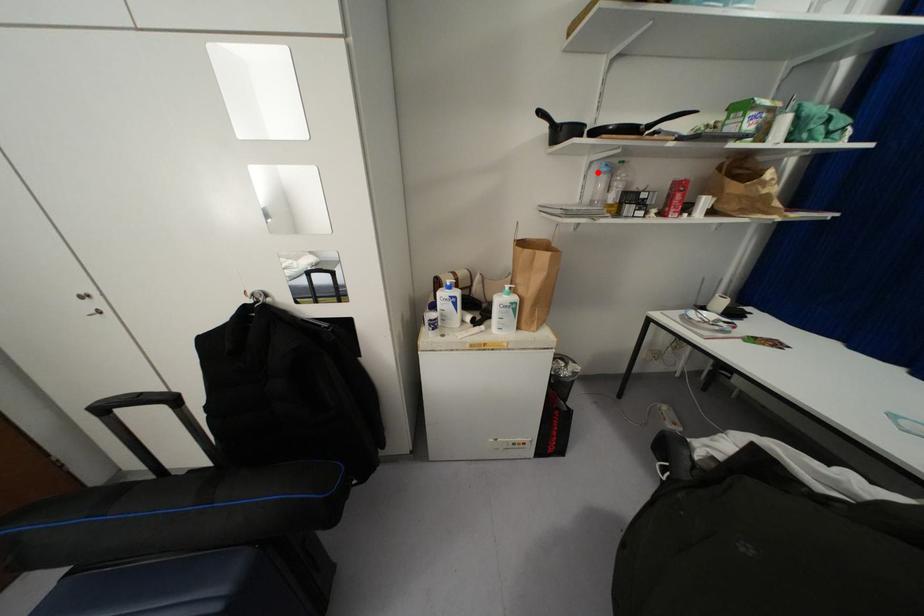
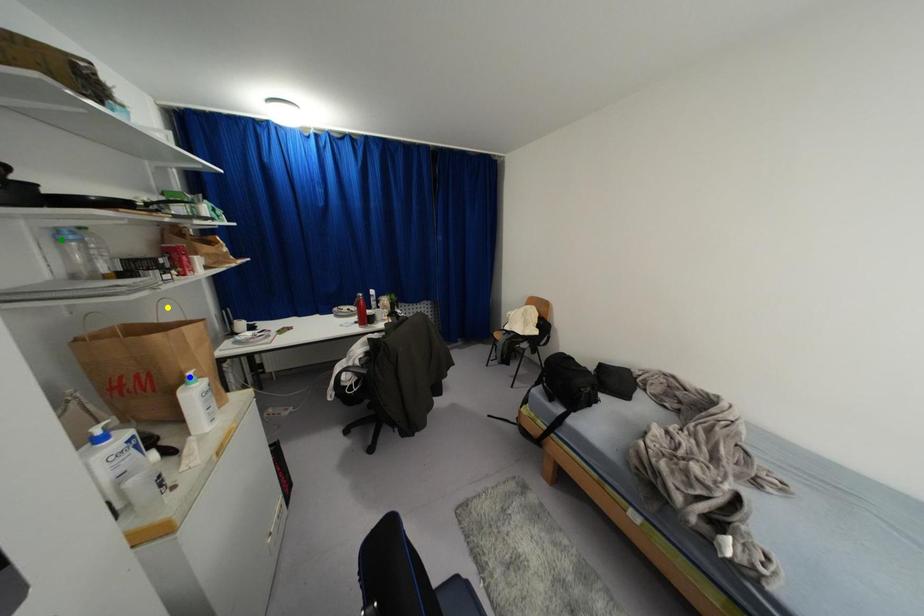
Question: I am providing you with two images of the same scene from different viewpoints. A red point is marked on the first image. You are given multiple points on the second image. Which spot in image 2 lines up with the point in image 1?

Choices:
 (A) yellow point
 (B) green point
 (C) blue point

Answer: (B)